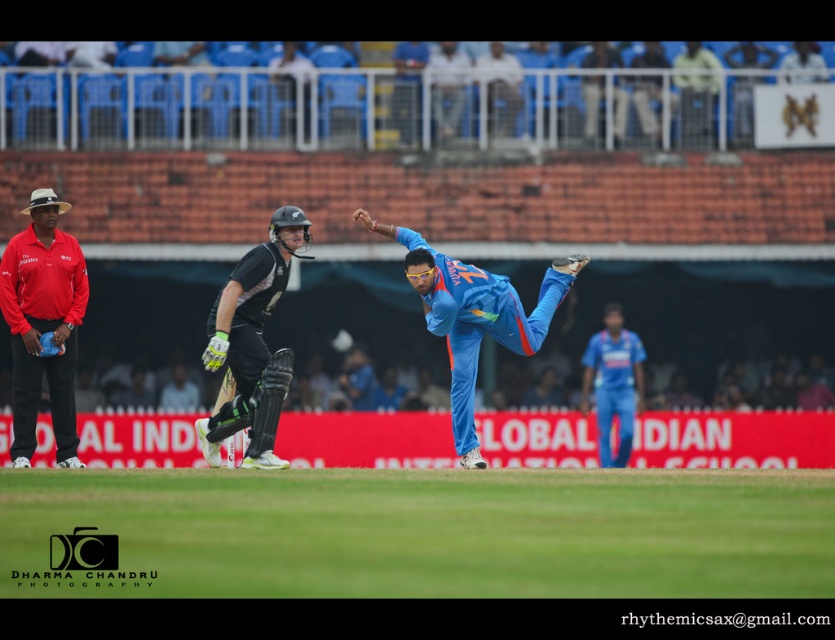
Question: Which object is the farthest from the blue fabric cricket uniform at center?

Choices:
 (A) red cotton shirt at left
 (B) blue fabric player at center
 (C) black matte cricket bat at center

Answer: (B)

Question: Among these points, which one is nearest to the camera?

Choices:
 (A) (282, 396)
 (B) (595, 336)

Answer: (A)

Question: Does black matte cricket bat at center appear on the left side of blue fabric player at center?

Choices:
 (A) no
 (B) yes

Answer: (B)

Question: Can you confirm if black matte cricket bat at center is wider than blue fabric cricket uniform at center?

Choices:
 (A) yes
 (B) no

Answer: (B)

Question: Among these points, which one is nearest to the camera?

Choices:
 (A) (448, 312)
 (B) (598, 406)
 (C) (43, 358)
 (D) (254, 385)

Answer: (D)

Question: Does red cotton shirt at left come behind blue fabric cricket uniform at center?

Choices:
 (A) yes
 (B) no

Answer: (B)